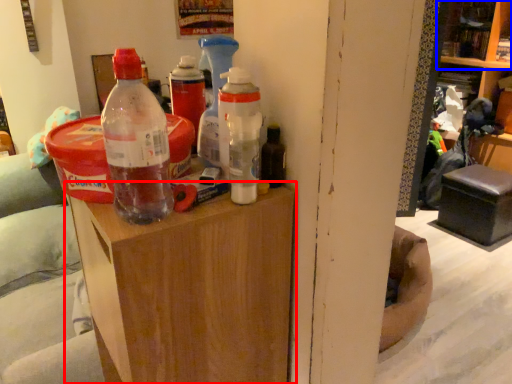
Question: Which point is further to the camera, furniture (highlighted by a red box) or shelf (highlighted by a blue box)?

Choices:
 (A) furniture
 (B) shelf

Answer: (B)